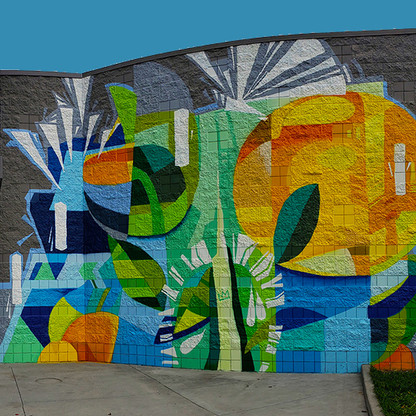
This screenshot has width=416, height=416. What are the coordinates of `mural` in the screenshot? It's located at (197, 243).